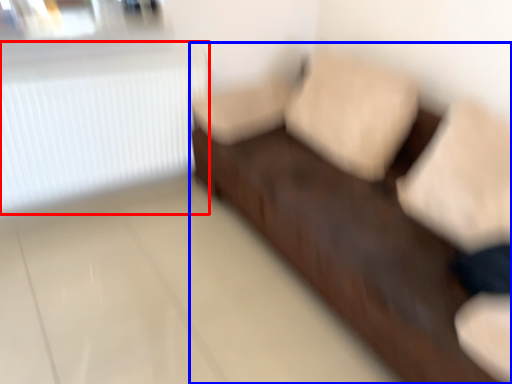
Question: Among these objects, which one is nearest to the camera, radiator (highlighted by a red box) or furniture (highlighted by a blue box)?

Choices:
 (A) radiator
 (B) furniture

Answer: (B)